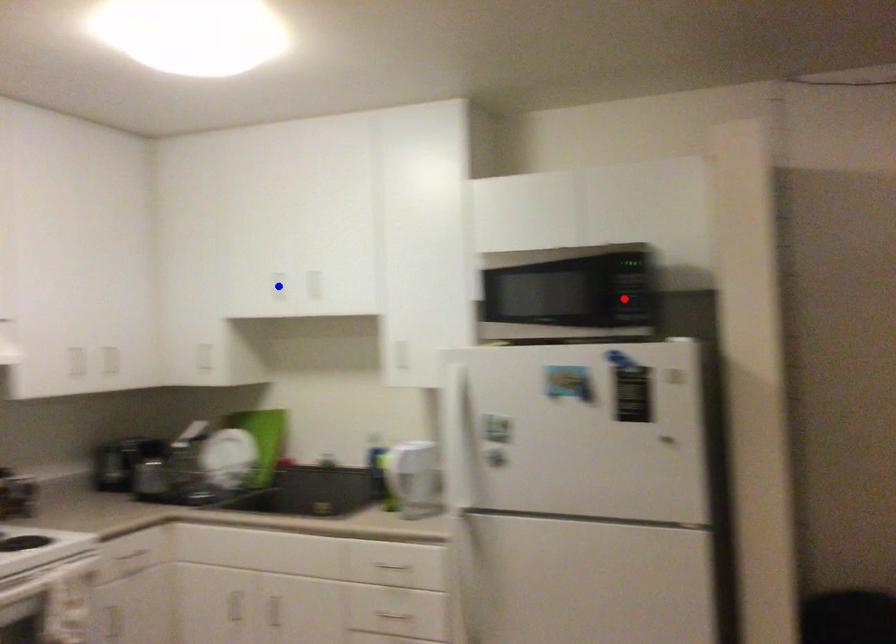
Question: In the image, two points are highlighted. Which point is nearer to the camera? Reply with the corresponding letter.

Choices:
 (A) blue point
 (B) red point

Answer: (B)